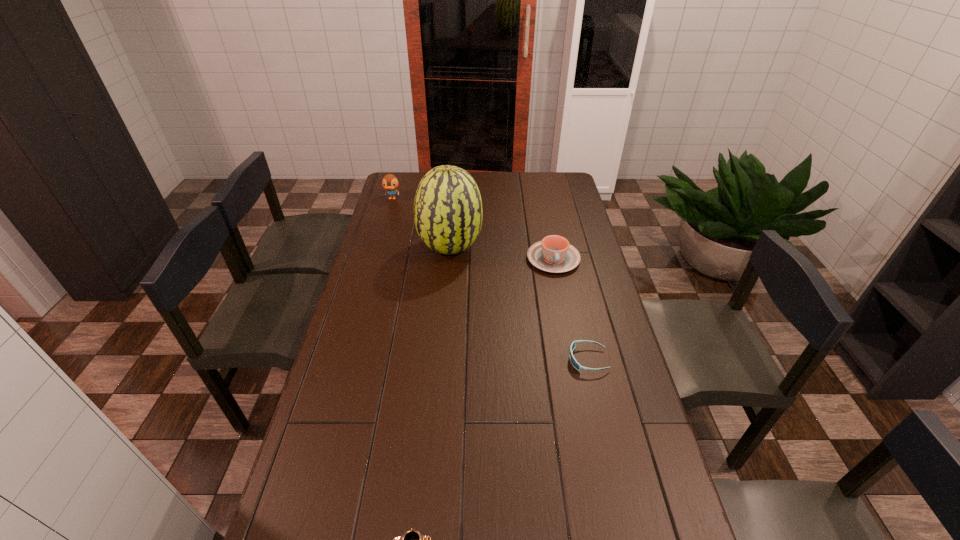
You are a GUI agent. You are given a task and a screenshot of the screen. Output one action in this format:
    pyautogui.click(x=<x>, y=<y>)
    Task: Click on the watermelon
    The width and height of the screenshot is (960, 540).
    Given the screenshot: What is the action you would take?
    pyautogui.click(x=448, y=213)

The height and width of the screenshot is (540, 960). What are the coordinates of `duck` in the screenshot? It's located at (390, 183).

Identify the location of the farthest object. This screenshot has width=960, height=540. (390, 183).

In order to click on the third tallest object in this screenshot , I will do `click(554, 254)`.

You are a GUI agent. You are given a task and a screenshot of the screen. Output one action in this format:
    pyautogui.click(x=<x>, y=<y>)
    Task: Click on the second shortest object
    This screenshot has width=960, height=540.
    Given the screenshot: What is the action you would take?
    pyautogui.click(x=573, y=345)

This screenshot has width=960, height=540. Identify the location of goggles. (573, 345).

Where is `free location located 0.300m on the front of the tallest object`? The image size is (960, 540). free location located 0.300m on the front of the tallest object is located at coordinates (x=444, y=326).

Locate an element on the screen. free spot located 0.170m on the front-facing side of the fourth shortest object is located at coordinates (385, 224).

Where is `free space located on the handle side of the third tallest object`? This screenshot has width=960, height=540. free space located on the handle side of the third tallest object is located at coordinates (564, 318).

This screenshot has height=540, width=960. Find the location of `free region located on the front-facing side of the goggles`. free region located on the front-facing side of the goggles is located at coordinates (477, 360).